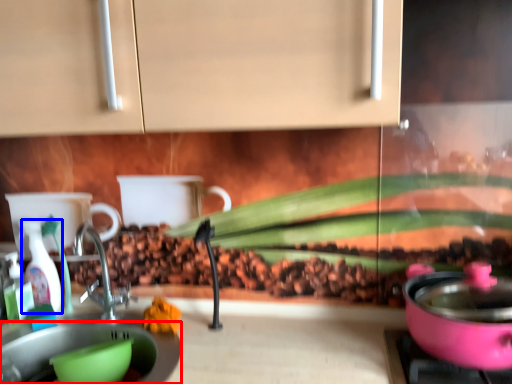
Question: Which of the following is the closest to the observer, sink (highlighted by a red box) or bottle (highlighted by a blue box)?

Choices:
 (A) sink
 (B) bottle

Answer: (A)